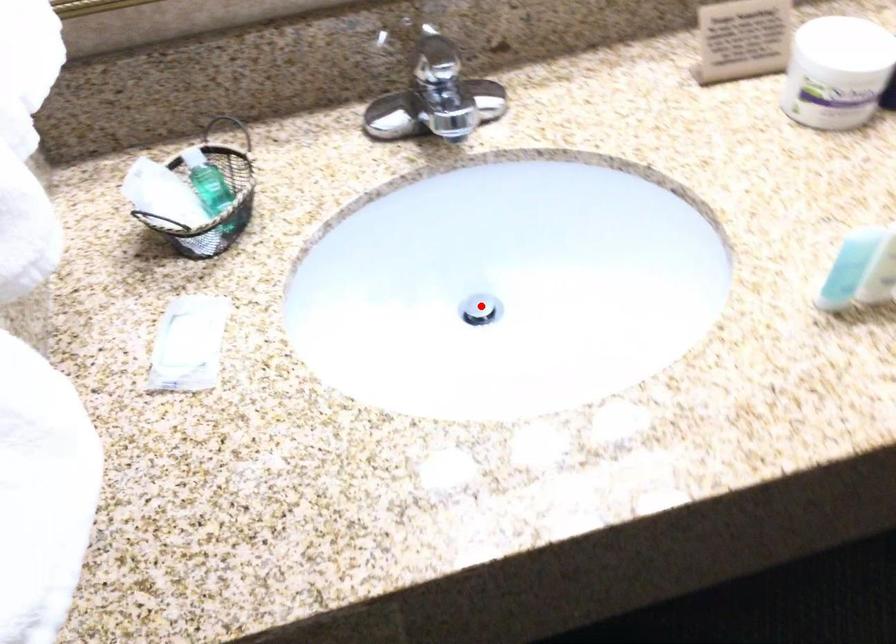
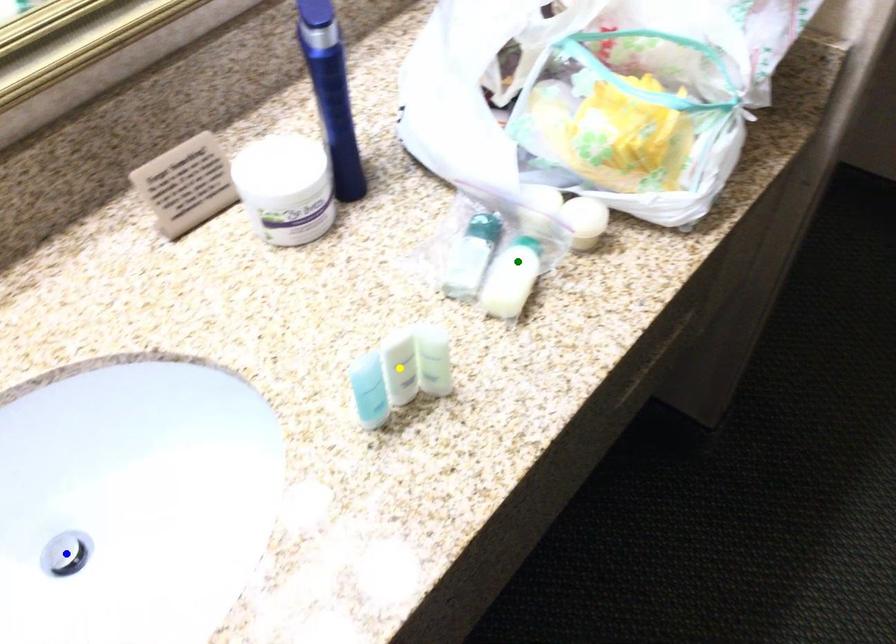
Question: I am providing you with two images of the same scene from different viewpoints. A red point is marked on the first image. You are given multiple points on the second image. Which point in image 2 represents the same 3d spot as the red point in image 1?

Choices:
 (A) green point
 (B) blue point
 (C) yellow point

Answer: (B)